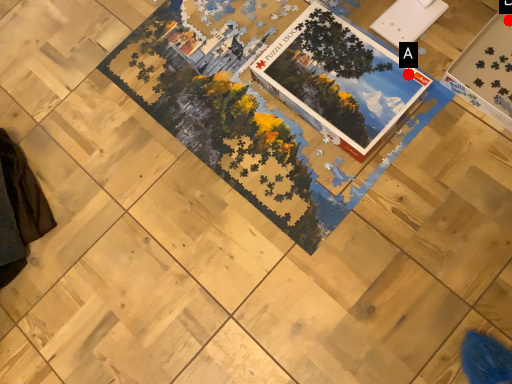
Question: Two points are circled on the image, labeled by A and B beside each circle. Which point appears closest to the camera in this image?

Choices:
 (A) A is closer
 (B) B is closer

Answer: (A)